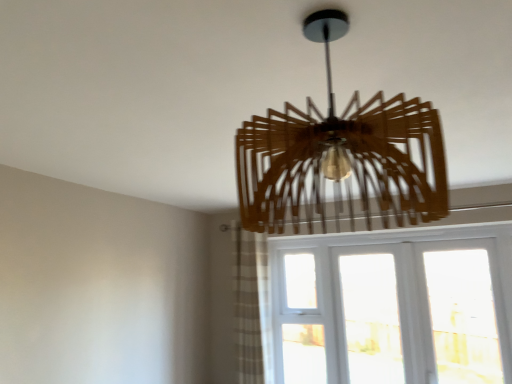
Question: Should I look upward or downward to see plaid fabric curtain at lower center?

Choices:
 (A) down
 (B) up

Answer: (A)

Question: Is white textured glass at lower right closer to camera compared to plaid fabric curtain at lower center?

Choices:
 (A) yes
 (B) no

Answer: (A)

Question: Considering the relative sizes of white textured glass at lower right and plaid fabric curtain at lower center in the image provided, is white textured glass at lower right thinner than plaid fabric curtain at lower center?

Choices:
 (A) no
 (B) yes

Answer: (B)

Question: Is white textured glass at lower right taller than plaid fabric curtain at lower center?

Choices:
 (A) yes
 (B) no

Answer: (B)

Question: Does white textured glass at lower right turn towards plaid fabric curtain at lower center?

Choices:
 (A) yes
 (B) no

Answer: (A)

Question: From a real-world perspective, is white textured glass at lower right beneath plaid fabric curtain at lower center?

Choices:
 (A) no
 (B) yes

Answer: (B)

Question: Is white textured glass at lower right completely or partially outside of plaid fabric curtain at lower center?

Choices:
 (A) yes
 (B) no

Answer: (A)

Question: From the image's perspective, is wooden chandelier at center over white textured glass at lower right?

Choices:
 (A) no
 (B) yes

Answer: (B)

Question: Does wooden chandelier at center have a greater height compared to white textured glass at lower right?

Choices:
 (A) yes
 (B) no

Answer: (B)

Question: Is wooden chandelier at center facing away from white textured glass at lower right?

Choices:
 (A) no
 (B) yes

Answer: (B)

Question: From a real-world perspective, does wooden chandelier at center stand above white textured glass at lower right?

Choices:
 (A) yes
 (B) no

Answer: (A)

Question: Is white textured glass at lower right completely or partially inside wooden chandelier at center?

Choices:
 (A) yes
 (B) no

Answer: (B)

Question: Is wooden chandelier at center beside white textured glass at lower right?

Choices:
 (A) yes
 (B) no

Answer: (B)

Question: Is plaid fabric curtain at lower center further to camera compared to white textured glass at lower right?

Choices:
 (A) yes
 (B) no

Answer: (A)